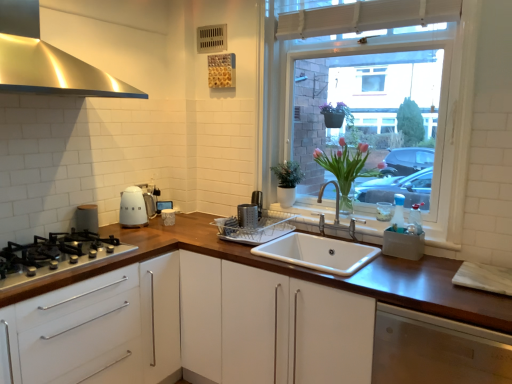
In order to click on wooden at center in this screenshot , I will do `click(300, 273)`.

Looking at this image, what is the approximate width of white ceramic sink at center?

20.27 inches.

You are a GUI agent. You are given a task and a screenshot of the screen. Output one action in this format:
    pyautogui.click(x=<x>, y=<y>)
    Task: Click on the matte white kettle at left, the 3th appliance in the right-to-left sequence
    This screenshot has width=512, height=384.
    Given the screenshot: What is the action you would take?
    pyautogui.click(x=87, y=218)

Can you confirm if white glass window at upper right is taller than matte black gas stove at lower left?

Yes, white glass window at upper right is taller than matte black gas stove at lower left.

From a real-world perspective, is white glass window at upper right on top of matte black gas stove at lower left?

Yes, from a real-world perspective, white glass window at upper right is over matte black gas stove at lower left

Could you tell me if white glass window at upper right is facing matte black gas stove at lower left?

Yes, white glass window at upper right is oriented towards matte black gas stove at lower left.

How different are the orientations of white glass window at upper right and matte black gas stove at lower left in degrees?

The angular difference between white glass window at upper right and matte black gas stove at lower left is 89.3 degrees.

In the scene shown: Does matte black gas stove at lower left come in front of dark brown wood at lower right, the 2th cabinetry when ordered from left to right?

No, it is not.

Can you confirm if matte black gas stove at lower left is thinner than dark brown wood at lower right, the 2th cabinetry when ordered from left to right?

Yes, matte black gas stove at lower left is thinner than dark brown wood at lower right, the 2th cabinetry when ordered from left to right.

From a real-world perspective, is matte black gas stove at lower left physically above dark brown wood at lower right, which is the 1th cabinetry in right-to-left order?

Yes, from a real-world perspective, matte black gas stove at lower left is over dark brown wood at lower right, which is the 1th cabinetry in right-to-left order

From the image's perspective, which is below, matte black gas stove at lower left or dark brown wood at lower right, which is the 1th cabinetry in right-to-left order?

dark brown wood at lower right, which is the 1th cabinetry in right-to-left order, is shown below in the image.

Can you confirm if white glass window at upper right is thinner than white ceramic sink at center?

Correct, the width of white glass window at upper right is less than that of white ceramic sink at center.

Based on the photo, from the image's perspective, who appears lower, white glass window at upper right or white ceramic sink at center?

white ceramic sink at center is shown below in the image.

How different are the orientations of white glass window at upper right and white ceramic sink at center in degrees?

They differ by 0.814 degrees in their facing directions.

Is white glass window at upper right smaller than white ceramic sink at center?

No.

Considering the relative sizes of stainless steel range hood at upper left and white glass window at upper right in the image provided, is stainless steel range hood at upper left smaller than white glass window at upper right?

No, stainless steel range hood at upper left is not smaller than white glass window at upper right.

Looking at their sizes, would you say stainless steel range hood at upper left is wider or thinner than white glass window at upper right?

In the image, stainless steel range hood at upper left appears to be wider than white glass window at upper right.

Could you tell me if stainless steel range hood at upper left is turned towards white glass window at upper right?

No, stainless steel range hood at upper left is not oriented towards white glass window at upper right.

From a real-world perspective, is stainless steel range hood at upper left over white glass window at upper right?

Yes.

Does silver metallic grater at center, the third appliance in the left-to-right sequence, have a lesser height compared to white glass window at upper right?

Yes, silver metallic grater at center, the third appliance in the left-to-right sequence, is shorter than white glass window at upper right.

Can you confirm if silver metallic grater at center, which ranks as the 1th appliance in right-to-left order, is wider than white glass window at upper right?

No.

In the scene shown: From the image's perspective, is silver metallic grater at center, which ranks as the 1th appliance in right-to-left order, above or below white glass window at upper right?

silver metallic grater at center, which ranks as the 1th appliance in right-to-left order, is situated lower than white glass window at upper right in the image.

How different are the orientations of silver metallic grater at center, the third appliance in the left-to-right sequence, and white glass window at upper right in degrees?

There is a 44-degree angle between the facing directions of silver metallic grater at center, the third appliance in the left-to-right sequence, and white glass window at upper right.

Could you measure the distance between matte black gas stove at lower left and matte white kettle at left, marked as the 1th appliance in a left-to-right arrangement?

matte black gas stove at lower left and matte white kettle at left, marked as the 1th appliance in a left-to-right arrangement, are 11.52 inches apart.

From the picture: Considering the relative positions of matte black gas stove at lower left and matte white kettle at left, the 3th appliance in the right-to-left sequence, in the image provided, is matte black gas stove at lower left behind matte white kettle at left, the 3th appliance in the right-to-left sequence,?

That is False.

Locate an element on the screen. The width and height of the screenshot is (512, 384). the 1st appliance to the right when counting from the matte black gas stove at lower left is located at coordinates (87, 218).

From the picture: Between matte black gas stove at lower left and matte white kettle at left, the 3th appliance in the right-to-left sequence, which one has smaller width?

matte white kettle at left, the 3th appliance in the right-to-left sequence, is thinner.

Which is nearer, (124, 216) or (351, 178)?

Point (124, 216).

Is matte white kettle at left, which appears as the 2th appliance when viewed from the right, wider than pink glass vase at center?

No.

Consider the image. Is matte white kettle at left, the second appliance from the left, in front of or behind pink glass vase at center in the image?

Clearly, matte white kettle at left, the second appliance from the left, is behind pink glass vase at center.

Is pink glass vase at center inside matte white kettle at left, which appears as the 2th appliance when viewed from the right?

No, pink glass vase at center is located outside of matte white kettle at left, which appears as the 2th appliance when viewed from the right.

I want to click on window lying above the matte black gas stove at lower left (from the image's perspective), so click(388, 96).

The height and width of the screenshot is (384, 512). There is a matte black gas stove at lower left. Find the location of `the 2nd cabinetry below it (from the image's perspective)`. the 2nd cabinetry below it (from the image's perspective) is located at coordinates (436, 350).

Which object lies further to the anchor point matte black gas stove at lower left, matte white kettle at left, which appears as the 2th appliance when viewed from the right, or wooden at center?

wooden at center.

When comparing their distances from matte black gas stove at lower left, does matte white kettle at left, the second appliance from the left, or pink glass vase at center seem closer?

Among the two, matte white kettle at left, the second appliance from the left, is located nearer to matte black gas stove at lower left.

When comparing their distances from pink glass vase at center, does white glass window at upper right or white glossy cabinet at lower left, which is the 1th cabinetry from left to right, seem closer?

Among the two, white glass window at upper right is located nearer to pink glass vase at center.

Looking at the image, which one is located closer to white glossy cabinet at lower left, which is the 1th cabinetry from left to right, matte white kettle at left, marked as the 1th appliance in a left-to-right arrangement, or matte white kettle at left, the second appliance from the left?

matte white kettle at left, marked as the 1th appliance in a left-to-right arrangement, lies closer to white glossy cabinet at lower left, which is the 1th cabinetry from left to right, than the other object.

From the image, which object appears to be farther from wooden at center, white glass window at upper right or matte white kettle at left, the second appliance from the left?

white glass window at upper right.

Considering their positions, is dark brown wood at lower right, which is the 1th cabinetry in right-to-left order, positioned closer to white glass window at upper right than silver metallic grater at center, the third appliance in the left-to-right sequence?

dark brown wood at lower right, which is the 1th cabinetry in right-to-left order, is positioned closer to the anchor white glass window at upper right.

Based on their spatial positions, is silver metallic grater at center, which ranks as the 1th appliance in right-to-left order, or dark brown wood at lower right, which is the 1th cabinetry in right-to-left order, further from matte white kettle at left, the second appliance from the left?

dark brown wood at lower right, which is the 1th cabinetry in right-to-left order, is positioned further to the anchor matte white kettle at left, the second appliance from the left.

Looking at this image, when comparing their distances from pink glass vase at center, does white glass window at upper right or matte white kettle at left, marked as the 1th appliance in a left-to-right arrangement, seem further?

matte white kettle at left, marked as the 1th appliance in a left-to-right arrangement, is positioned further to the anchor pink glass vase at center.

This screenshot has width=512, height=384. I want to click on gas stove between stainless steel range hood at upper left and white glossy cabinet at lower left, which is the second cabinetry from right to left, in the up-down direction, so click(55, 255).

You are a GUI agent. You are given a task and a screenshot of the screen. Output one action in this format:
    pyautogui.click(x=<x>, y=<y>)
    Task: Click on the cabinetry between matte black gas stove at lower left and wooden at center in the horizontal direction
    
    Given the screenshot: What is the action you would take?
    pyautogui.click(x=99, y=329)

I want to click on countertop that lies between stainless steel range hood at upper left and white glossy cabinet at lower left, which is the 1th cabinetry from left to right, from top to bottom, so click(300, 273).

Locate an element on the screen. The image size is (512, 384). gas stove between white glossy cabinet at lower left, which is the second cabinetry from right to left, and matte white kettle at left, the second appliance from the left, from front to back is located at coordinates (55, 255).